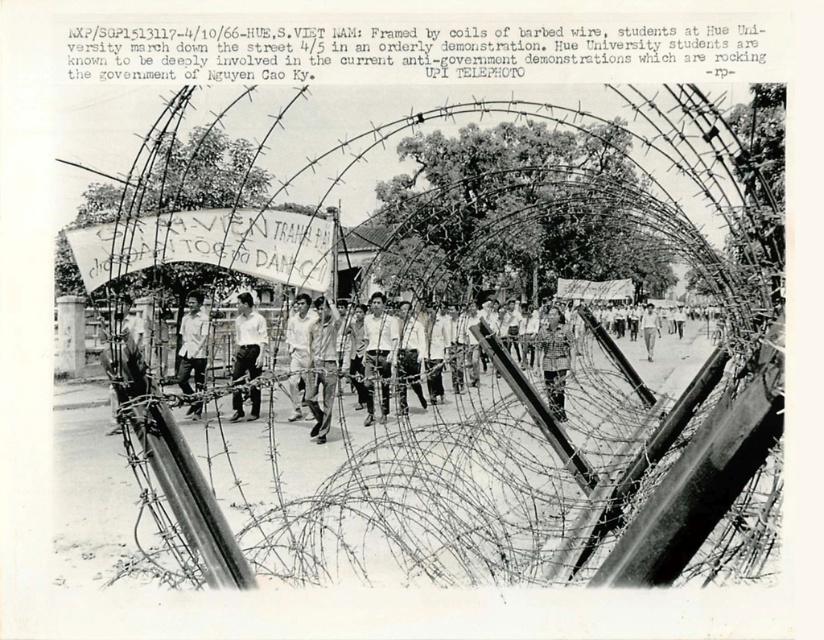
Based on the photo, you are a photographer analyzing the protest scene in Hue. You notice two individuals in the midground wearing a white shirt at center and a light gray shirt at center. Which shirt is located to the right of the other?

The white shirt at center is positioned on the right side of light gray shirt at center.